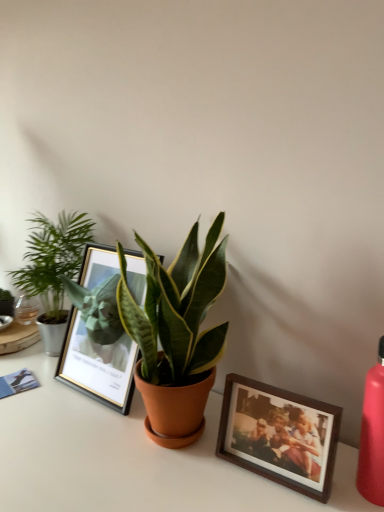
Locate an element on the screen. The image size is (384, 512). free space in front of metallic gold picture frame at center, positioned as the 1th picture frame in back-to-front order is located at coordinates (79, 449).